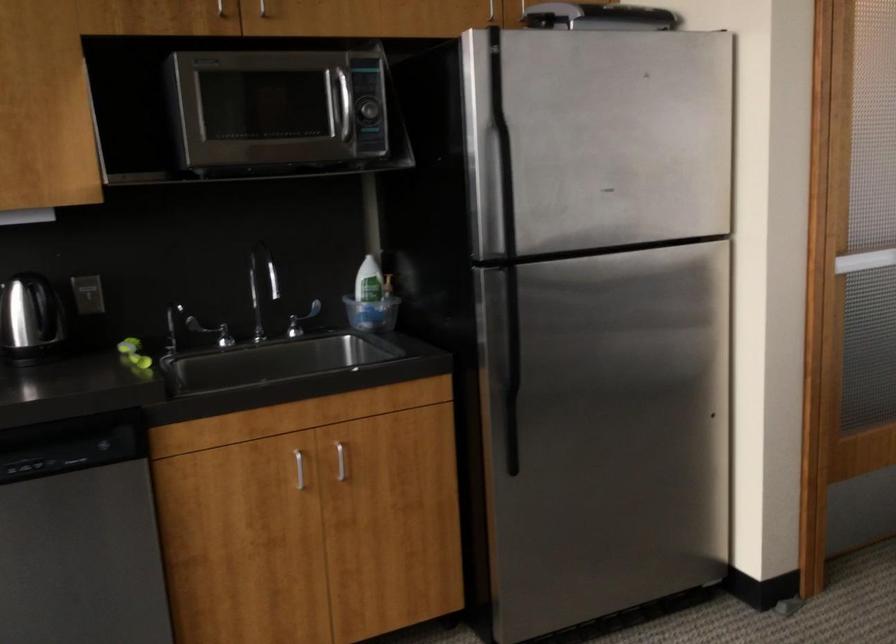
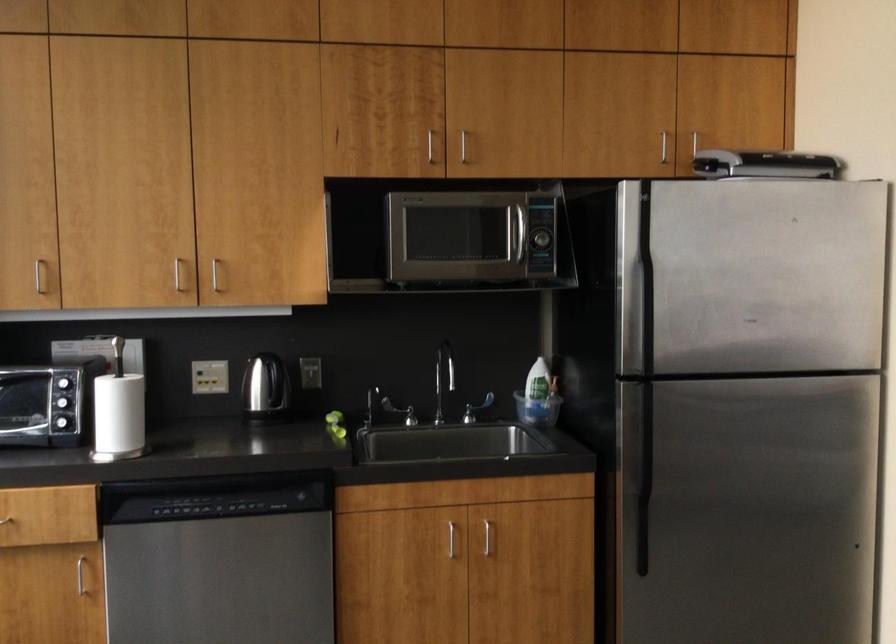
Where in the second image is the point corresponding to [343,465] from the first image?

(490, 542)